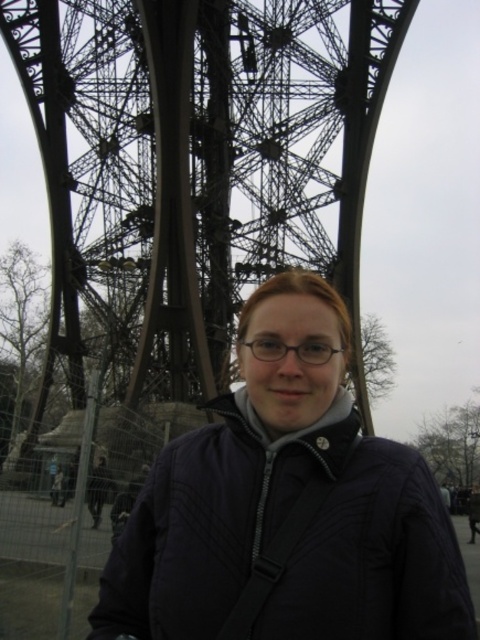
You are a photographer trying to capture a photo of the metallic structure at center and the matte black jacket at center. If you want to ensure both are fully visible in the frame, which object should you focus on first to avoid cropping either?

The metallic structure at center might be wider than matte black jacket at center, so you should focus on the metallic structure at center first to ensure it fits entirely within the frame before adjusting for the matte black jacket at center.

You are a photographer wanting to capture the metallic structure at center and the matte black jacket at center in a single frame. Based on their positions, which object should you adjust your camera angle to focus on first to ensure both are in the shot?

The metallic structure at center is to the left of the matte black jacket at center. To capture both in a single frame, adjust your camera angle to focus on the metallic structure at center first since it is positioned to the left, ensuring the matte black jacket at center remains within the frame.